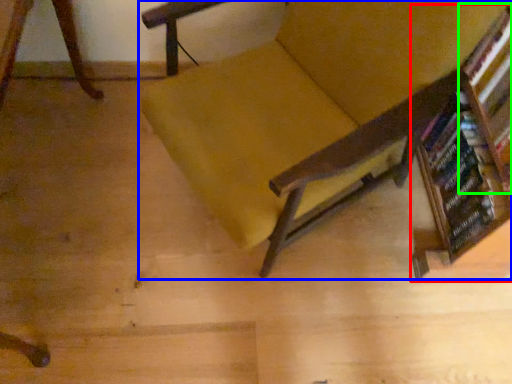
Question: Which object is positioned closest to bookcase (highlighted by a red box)? Select from chair (highlighted by a blue box) and shelf (highlighted by a green box).

Choices:
 (A) chair
 (B) shelf

Answer: (B)